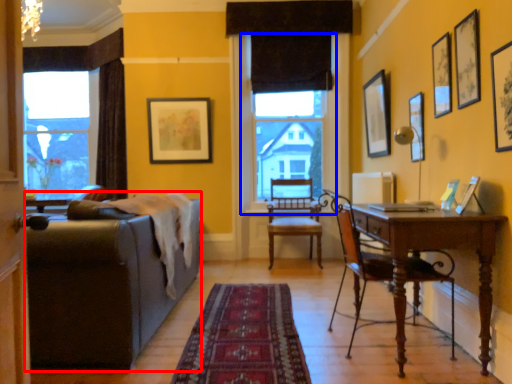
Question: Which object is closer to the camera taking this photo, studio couch (highlighted by a red box) or window screen (highlighted by a blue box)?

Choices:
 (A) studio couch
 (B) window screen

Answer: (A)